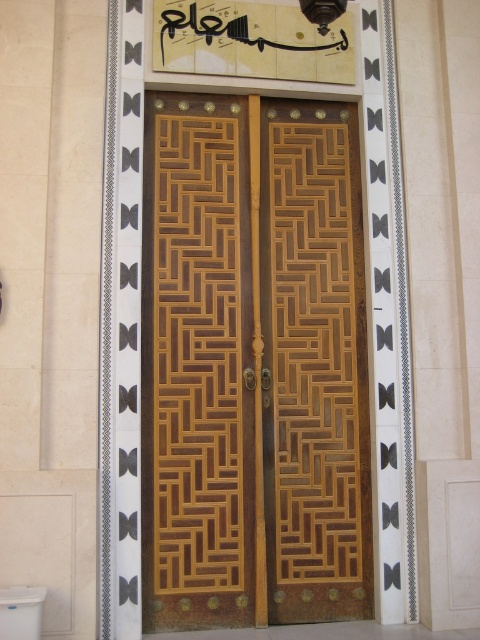
Where is `wooden door at center`? This screenshot has width=480, height=640. wooden door at center is located at coordinates (252, 364).

Does wooden door at center appear on the left side of white glossy toilet bowl at lower left?

No, wooden door at center is not to the left of white glossy toilet bowl at lower left.

The height and width of the screenshot is (640, 480). Describe the element at coordinates (252, 364) in the screenshot. I see `wooden door at center` at that location.

Find the location of a particular element. wooden door at center is located at coordinates (x=252, y=364).